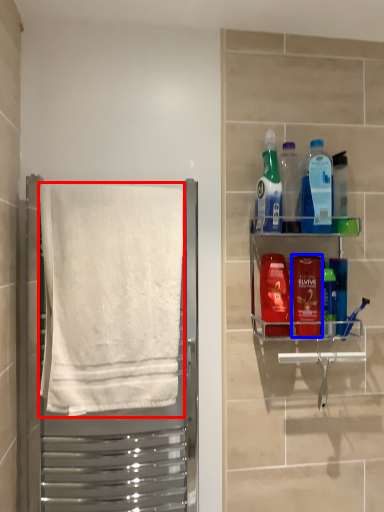
Question: Which object is further to the camera taking this photo, towel (highlighted by a red box) or mouthwash (highlighted by a blue box)?

Choices:
 (A) towel
 (B) mouthwash

Answer: (B)